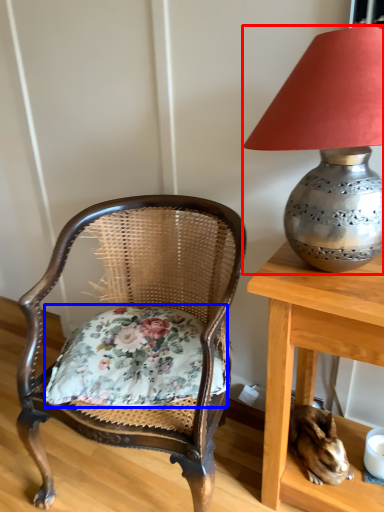
Question: Which of the following is the farthest to the observer, lamp (highlighted by a red box) or pillow (highlighted by a blue box)?

Choices:
 (A) lamp
 (B) pillow

Answer: (B)